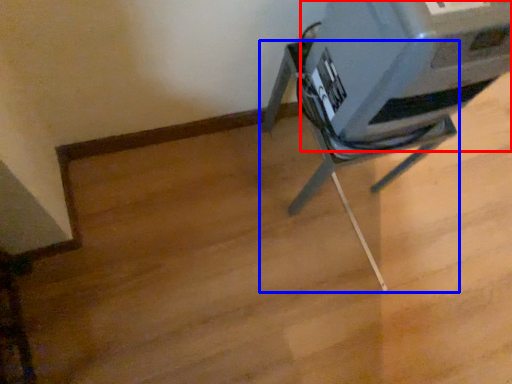
Question: Which object appears farthest to the camera in this image, printer (highlighted by a red box) or furniture (highlighted by a blue box)?

Choices:
 (A) printer
 (B) furniture

Answer: (B)